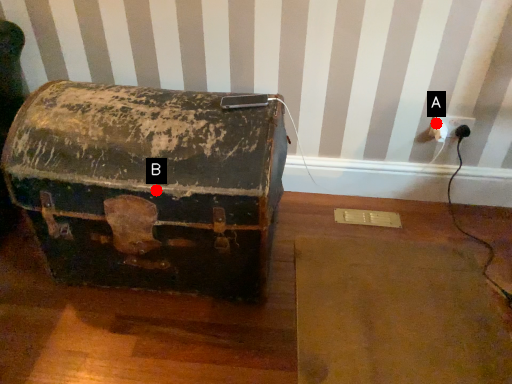
Question: Two points are circled on the image, labeled by A and B beside each circle. Which point appears closest to the camera in this image?

Choices:
 (A) A is closer
 (B) B is closer

Answer: (B)